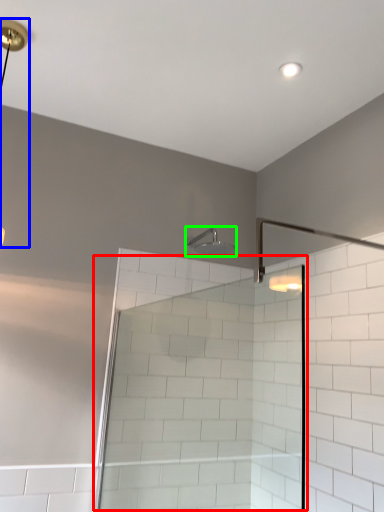
Question: Which object is positioned farthest from screen door (highlighted by a red box)? Select from lamp (highlighted by a blue box) and shower (highlighted by a green box).

Choices:
 (A) lamp
 (B) shower

Answer: (A)